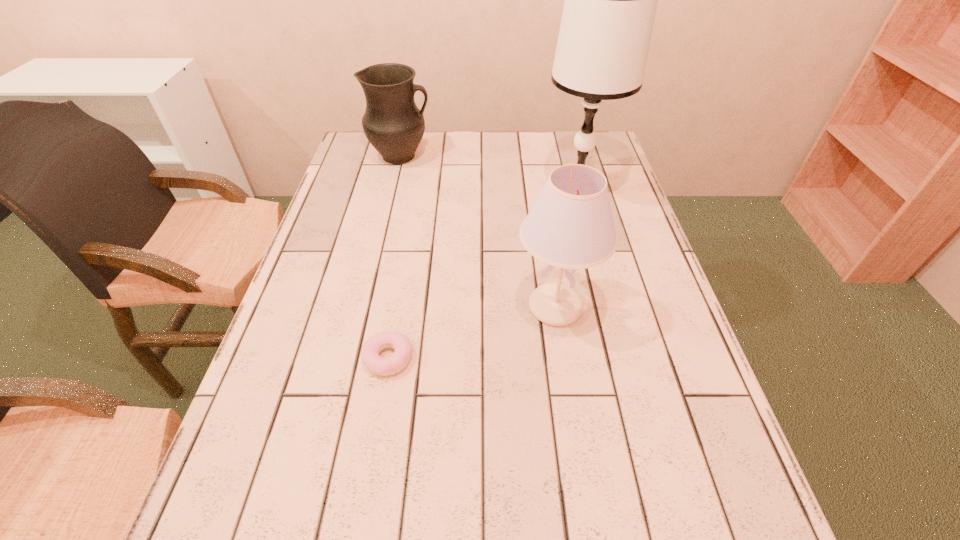
In order to click on free location that satisfies the following two spatial constraints: 1. on the handle side of the tallest object; 2. on the left side of the pitcher in this screenshot , I will do `click(393, 192)`.

Identify the location of vacant space that satisfies the following two spatial constraints: 1. on the handle side of the pitcher; 2. on the back side of the shortest object. (353, 358).